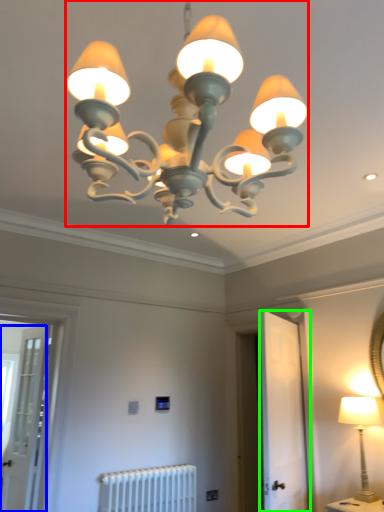
Question: Which object is positioned farthest from lamp (highlighted by a red box)? Select from screen door (highlighted by a blue box) and screen door (highlighted by a green box).

Choices:
 (A) screen door
 (B) screen door

Answer: (A)